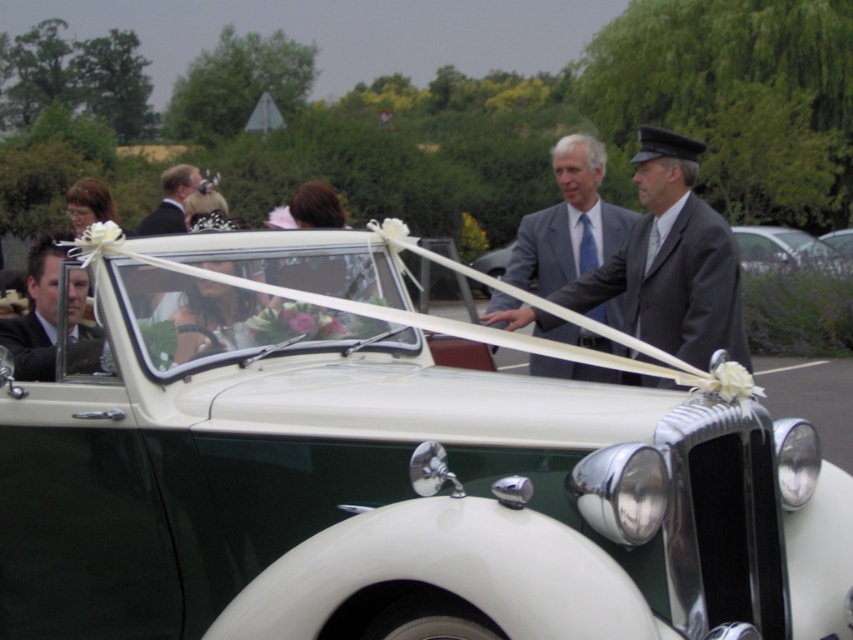
Can you confirm if white glossy convertible at center is positioned to the right of matte black suit at left?

Correct, you'll find white glossy convertible at center to the right of matte black suit at left.

Who is more distant from viewer, (202, 442) or (39, 342)?

Point (39, 342)

You are a GUI agent. You are given a task and a screenshot of the screen. Output one action in this format:
    pyautogui.click(x=<x>, y=<y>)
    Task: Click on the white glossy convertible at center
    This screenshot has height=640, width=853.
    Given the screenshot: What is the action you would take?
    pyautogui.click(x=387, y=472)

Does point (589, 220) come behind point (55, 248)?

That is True.

Does matte gray suit at center appear on the right side of matte black suit at left?

Yes, matte gray suit at center is to the right of matte black suit at left.

Which is in front, point (570, 154) or point (73, 269)?

Point (73, 269) is in front.

Identify the location of matte gray suit at center. The height and width of the screenshot is (640, 853). (569, 221).

Does point (126, 305) come farther from viewer compared to point (184, 186)?

No, (126, 305) is in front of (184, 186).

Between point (734, 403) and point (183, 163), which one is positioned in front?

Point (734, 403)

The height and width of the screenshot is (640, 853). What do you see at coordinates (387, 472) in the screenshot?
I see `white glossy convertible at center` at bounding box center [387, 472].

Where is `white glossy convertible at center`? white glossy convertible at center is located at coordinates (387, 472).